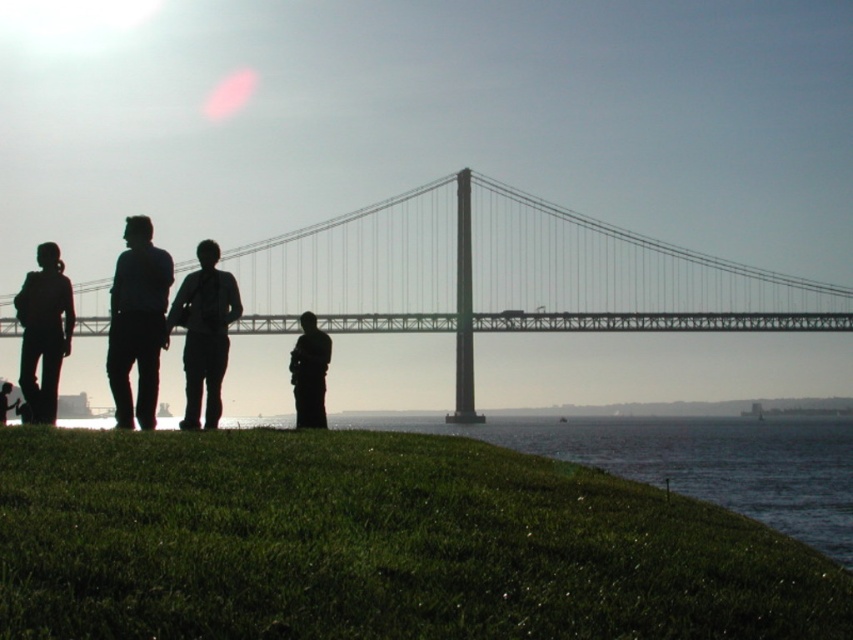
You are a photographer planning to take a photo of the silhouette backpack at left and the dark matte figure at center. Which object should you focus on if you want to capture the larger subject in your shot?

The silhouette backpack at left is larger in size than the dark matte figure at center, so you should focus on the silhouette backpack at left to capture the larger subject in your shot.

You are a photographer trying to capture the suspension bridge in the background. You notice the silhouette backpack at left and the dark matte figure at center in your shot. Which object should you move to the right to avoid blocking the bridge?

You should move the silhouette backpack at left to the right because it is currently positioned to the left of the dark matte figure at center, which is closer to the center of the frame and might be obscuring the bridge. Moving the backpack to the right would shift it out of the main viewing area, allowing a clearer view of the bridge.